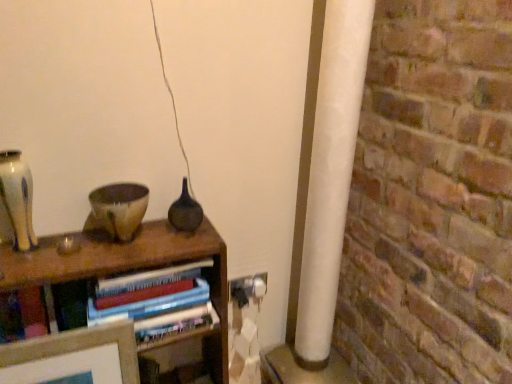
Measure the distance between point (66, 311) and camera.

The distance of point (66, 311) from camera is 3.60 feet.

The height and width of the screenshot is (384, 512). Identify the location of matte dark glass vase at center, which is the first glass vase from right to left. (185, 211).

Measure the distance between matte dark glass vase at center, the 2th glass vase viewed from the left, and camera.

matte dark glass vase at center, the 2th glass vase viewed from the left, is 1.21 meters away from camera.

Describe the element at coordinates (118, 209) in the screenshot. I see `speckled ceramic bowl at center` at that location.

How much space does matte beige vase at left, arranged as the 2th glass vase when viewed from the right, occupy vertically?

It is 25.36 centimeters.

Describe the element at coordinates (18, 198) in the screenshot. I see `matte beige vase at left, positioned as the second glass vase in back-to-front order` at that location.

The height and width of the screenshot is (384, 512). What are the coordinates of `hardcover books at center` in the screenshot? It's located at (147, 306).

Does matte dark glass vase at center, the 2th glass vase viewed from the left, have a lesser width compared to matte beige vase at left, positioned as the second glass vase in back-to-front order?

Incorrect, the width of matte dark glass vase at center, the 2th glass vase viewed from the left, is not less than that of matte beige vase at left, positioned as the second glass vase in back-to-front order.

Who is taller, matte dark glass vase at center, the 2th glass vase in the front-to-back sequence, or matte beige vase at left, the 1th glass vase viewed from the front?

Standing taller between the two is matte beige vase at left, the 1th glass vase viewed from the front.

Find the location of `glass vase that appears above the matte dark glass vase at center, the 2th glass vase in the front-to-back sequence (from the image's perspective)`. glass vase that appears above the matte dark glass vase at center, the 2th glass vase in the front-to-back sequence (from the image's perspective) is located at coordinates (18, 198).

Considering the sizes of objects matte dark glass vase at center, which appears as the 1th glass vase when viewed from the back, and matte beige vase at left, positioned as the second glass vase in back-to-front order, in the image provided, who is bigger, matte dark glass vase at center, which appears as the 1th glass vase when viewed from the back, or matte beige vase at left, positioned as the second glass vase in back-to-front order,?

With larger size is matte dark glass vase at center, which appears as the 1th glass vase when viewed from the back.

Does point (237, 282) appear closer or farther from the camera than point (110, 221)?

Point (237, 282) appears to be farther away from the viewer than point (110, 221).

Image resolution: width=512 pixels, height=384 pixels. What are the coordinates of `electric outlet below the speckled ceramic bowl at center (from the image's perspective)` in the screenshot? It's located at coord(248,288).

Can you confirm if white plastic electric outlet at lower right is taller than speckled ceramic bowl at center?

Incorrect, the height of white plastic electric outlet at lower right is not larger of that of speckled ceramic bowl at center.

From a real-world perspective, does white plastic electric outlet at lower right stand above speckled ceramic bowl at center?

Actually, white plastic electric outlet at lower right is physically below speckled ceramic bowl at center in the real world.

Which object is further away from the camera, hardcover books at center or white plastic electric outlet at lower right?

white plastic electric outlet at lower right is behind.

Can we say hardcover books at center lies outside white plastic electric outlet at lower right?

Yes.

From the image's perspective, who appears lower, hardcover books at center or white plastic electric outlet at lower right?

hardcover books at center is shown below in the image.

Does hardcover books at center turn towards white plastic electric outlet at lower right?

No, hardcover books at center does not turn towards white plastic electric outlet at lower right.

Considering the relative positions of speckled ceramic bowl at center and matte beige vase at left, positioned as the second glass vase in back-to-front order, in the image provided, is speckled ceramic bowl at center in front of matte beige vase at left, positioned as the second glass vase in back-to-front order,?

No, speckled ceramic bowl at center is further to the viewer.

Is speckled ceramic bowl at center aimed at matte beige vase at left, arranged as the 2th glass vase when viewed from the right?

No, speckled ceramic bowl at center is not turned towards matte beige vase at left, arranged as the 2th glass vase when viewed from the right.

How different are the orientations of speckled ceramic bowl at center and matte beige vase at left, arranged as the 2th glass vase when viewed from the right, in degrees?

The angle between the facing direction of speckled ceramic bowl at center and the facing direction of matte beige vase at left, arranged as the 2th glass vase when viewed from the right, is 0.00241 degrees.

This screenshot has height=384, width=512. Identify the location of candle holder above the hardcover books at center (from the image's perspective). (118, 209).

Consider the image. What's the angular difference between hardcover books at center and speckled ceramic bowl at center's facing directions?

The facing directions of hardcover books at center and speckled ceramic bowl at center are 0.502 degrees apart.

Is hardcover books at center further to the viewer compared to speckled ceramic bowl at center?

No, hardcover books at center is closer to the viewer.

Which of these two, hardcover books at center or speckled ceramic bowl at center, is smaller?

speckled ceramic bowl at center.

Relative to hardcover books at center, is white plastic electric outlet at lower right in front or behind?

white plastic electric outlet at lower right is positioned farther from the viewer than hardcover books at center.

The height and width of the screenshot is (384, 512). In order to click on electric outlet above the hardcover books at center (from the image's perspective) in this screenshot , I will do `click(248, 288)`.

In the scene shown: Is white plastic electric outlet at lower right turned away from hardcover books at center?

No, white plastic electric outlet at lower right is not facing away from hardcover books at center.

Is white plastic electric outlet at lower right next to matte beige vase at left, arranged as the 2th glass vase when viewed from the right, and touching it?

white plastic electric outlet at lower right and matte beige vase at left, arranged as the 2th glass vase when viewed from the right, are clearly separated.

Where is `electric outlet behind the matte beige vase at left, positioned as the second glass vase in back-to-front order`? electric outlet behind the matte beige vase at left, positioned as the second glass vase in back-to-front order is located at coordinates (248, 288).

Does white plastic electric outlet at lower right have a lesser width compared to matte beige vase at left, positioned as the second glass vase in back-to-front order?

Indeed, white plastic electric outlet at lower right has a lesser width compared to matte beige vase at left, positioned as the second glass vase in back-to-front order.

Identify the location of glass vase behind the matte beige vase at left, arranged as the first glass vase when viewed from the left. (185, 211).

In the image, there is a speckled ceramic bowl at center. Where is `electric outlet below it (from a real-world perspective)`? The height and width of the screenshot is (384, 512). electric outlet below it (from a real-world perspective) is located at coordinates (248, 288).

Looking at the image, which one is located closer to white plastic electric outlet at lower right, matte dark glass vase at center, the 2th glass vase viewed from the left, or matte beige vase at left, positioned as the second glass vase in back-to-front order?

Based on the image, matte dark glass vase at center, the 2th glass vase viewed from the left, appears to be nearer to white plastic electric outlet at lower right.

Based on their spatial positions, is matte dark glass vase at center, which is the first glass vase from right to left, or white plastic electric outlet at lower right further from matte beige vase at left, the 1th glass vase viewed from the front?

white plastic electric outlet at lower right is positioned further to the anchor matte beige vase at left, the 1th glass vase viewed from the front.

In the scene shown: Estimate the real-world distances between objects in this image. Which object is closer to hardcover books at center, speckled ceramic bowl at center or matte beige vase at left, arranged as the first glass vase when viewed from the left?

Based on the image, speckled ceramic bowl at center appears to be nearer to hardcover books at center.

Looking at the image, which one is located closer to hardcover books at center, matte dark glass vase at center, the 2th glass vase in the front-to-back sequence, or speckled ceramic bowl at center?

Among the two, speckled ceramic bowl at center is located nearer to hardcover books at center.

Looking at the image, which one is located closer to matte dark glass vase at center, the 2th glass vase in the front-to-back sequence, speckled ceramic bowl at center or white plastic electric outlet at lower right?

speckled ceramic bowl at center is closer to matte dark glass vase at center, the 2th glass vase in the front-to-back sequence.

When comparing their distances from white plastic electric outlet at lower right, does matte dark glass vase at center, the 2th glass vase in the front-to-back sequence, or speckled ceramic bowl at center seem further?

speckled ceramic bowl at center is further to white plastic electric outlet at lower right.

When comparing their distances from matte beige vase at left, the 1th glass vase viewed from the front, does white plastic electric outlet at lower right or matte dark glass vase at center, the 2th glass vase viewed from the left, seem closer?

matte dark glass vase at center, the 2th glass vase viewed from the left, lies closer to matte beige vase at left, the 1th glass vase viewed from the front, than the other object.

From the image, which object appears to be nearer to matte beige vase at left, arranged as the first glass vase when viewed from the left, speckled ceramic bowl at center or white plastic electric outlet at lower right?

speckled ceramic bowl at center.

Identify the location of candle holder between matte beige vase at left, arranged as the 2th glass vase when viewed from the right, and matte dark glass vase at center, the 2th glass vase viewed from the left, from left to right. The height and width of the screenshot is (384, 512). (118, 209).

Where is `glass vase between matte beige vase at left, arranged as the 2th glass vase when viewed from the right, and hardcover books at center from top to bottom`? This screenshot has height=384, width=512. glass vase between matte beige vase at left, arranged as the 2th glass vase when viewed from the right, and hardcover books at center from top to bottom is located at coordinates (185, 211).

Identify the location of candle holder between matte beige vase at left, arranged as the 2th glass vase when viewed from the right, and white plastic electric outlet at lower right. (118, 209).

In order to click on glass vase situated between matte beige vase at left, arranged as the first glass vase when viewed from the left, and white plastic electric outlet at lower right from left to right in this screenshot , I will do `click(185, 211)`.